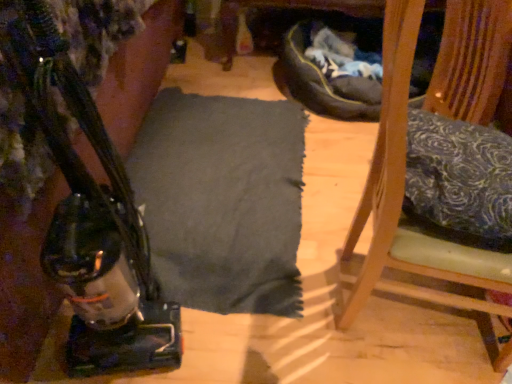
Find the location of a particular element. This screenshot has height=384, width=512. vacant region to the right of matte black vacuum cleaner at left is located at coordinates (234, 332).